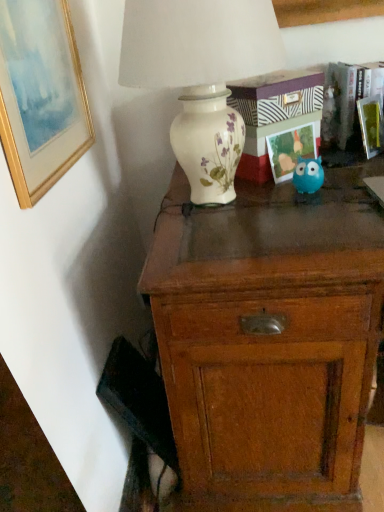
Where is `vacant region in front of white ceramic vase at upper center`? This screenshot has height=512, width=384. vacant region in front of white ceramic vase at upper center is located at coordinates (251, 247).